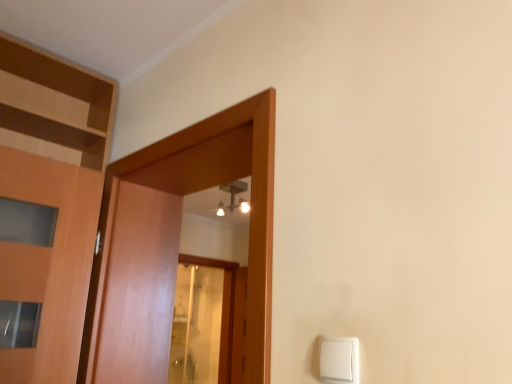
Find the location of a particular element. Image resolution: width=512 pixels, height=384 pixels. white plastic light switch at lower right is located at coordinates (339, 360).

What do you see at coordinates (339, 360) in the screenshot?
I see `white plastic light switch at lower right` at bounding box center [339, 360].

This screenshot has width=512, height=384. Describe the element at coordinates (176, 243) in the screenshot. I see `wooden door at center` at that location.

Find the location of `wooden door at center`. wooden door at center is located at coordinates (176, 243).

Identify the location of white plastic light switch at lower right. This screenshot has width=512, height=384. (339, 360).

Can you confirm if white plastic light switch at lower right is positioned to the right of wooden door at center?

Indeed, white plastic light switch at lower right is positioned on the right side of wooden door at center.

Relative to wooden door at center, is white plastic light switch at lower right in front or behind?

white plastic light switch at lower right is in front of wooden door at center.

Is point (343, 351) positioned before point (186, 131)?

Yes, it is.

From the image's perspective, which object appears higher, white plastic light switch at lower right or wooden door at center?

wooden door at center, from the image's perspective.

From a real-world perspective, which is physically above, white plastic light switch at lower right or wooden door at center?

From a 3D spatial view, wooden door at center is above.

Can you confirm if white plastic light switch at lower right is thinner than wooden door at center?

Yes.

Considering the sizes of white plastic light switch at lower right and wooden door at center in the image, is white plastic light switch at lower right taller or shorter than wooden door at center?

Considering their sizes, white plastic light switch at lower right has less height than wooden door at center.

Does white plastic light switch at lower right have a smaller size compared to wooden door at center?

Correct, white plastic light switch at lower right occupies less space than wooden door at center.

Choose the correct answer: Is white plastic light switch at lower right inside wooden door at center or outside it?

white plastic light switch at lower right is not enclosed by wooden door at center.

Are white plastic light switch at lower right and wooden door at center making contact?

No, white plastic light switch at lower right is not with wooden door at center.

Is white plastic light switch at lower right turned away from wooden door at center?

No, white plastic light switch at lower right's orientation is not away from wooden door at center.

How many degrees apart are the facing directions of white plastic light switch at lower right and wooden door at center?

The facing directions of white plastic light switch at lower right and wooden door at center are 6.35 degrees apart.

This screenshot has height=384, width=512. Identify the location of door above the white plastic light switch at lower right (from the image's perspective). (176, 243).

Visually, is wooden door at center positioned to the left or to the right of white plastic light switch at lower right?

wooden door at center is to the left of white plastic light switch at lower right.

Consider the image. Is wooden door at center behind white plastic light switch at lower right?

Yes, the depth of wooden door at center is greater than that of white plastic light switch at lower right.

Is point (103, 200) closer or farther from the camera than point (320, 348)?

Point (103, 200) appears to be farther away from the viewer than point (320, 348).

From the image's perspective, is wooden door at center over white plastic light switch at lower right?

Correct, wooden door at center appears higher than white plastic light switch at lower right in the image.

From a real-world perspective, which is physically above, wooden door at center or white plastic light switch at lower right?

From a 3D spatial view, wooden door at center is above.

Which object is wider, wooden door at center or white plastic light switch at lower right?

wooden door at center is wider.

Can you confirm if wooden door at center is shorter than white plastic light switch at lower right?

No.

Considering the sizes of objects wooden door at center and white plastic light switch at lower right in the image provided, who is bigger, wooden door at center or white plastic light switch at lower right?

Bigger between the two is wooden door at center.

Would you say white plastic light switch at lower right is part of wooden door at center's contents?

No, white plastic light switch at lower right is not surrounded by wooden door at center.

Are wooden door at center and white plastic light switch at lower right located far from each other?

wooden door at center is near white plastic light switch at lower right, not far away.

Could you tell me if wooden door at center is turned towards white plastic light switch at lower right?

No, wooden door at center is not aimed at white plastic light switch at lower right.

How different are the orientations of wooden door at center and white plastic light switch at lower right in degrees?

The facing directions of wooden door at center and white plastic light switch at lower right are 6.35 degrees apart.

This screenshot has height=384, width=512. I want to click on door above the white plastic light switch at lower right (from a real-world perspective), so click(x=176, y=243).

Find the location of a particular element. This screenshot has height=384, width=512. door that is behind the white plastic light switch at lower right is located at coordinates (176, 243).

Where is `door above the white plastic light switch at lower right (from a real-world perspective)`? This screenshot has height=384, width=512. door above the white plastic light switch at lower right (from a real-world perspective) is located at coordinates (176, 243).